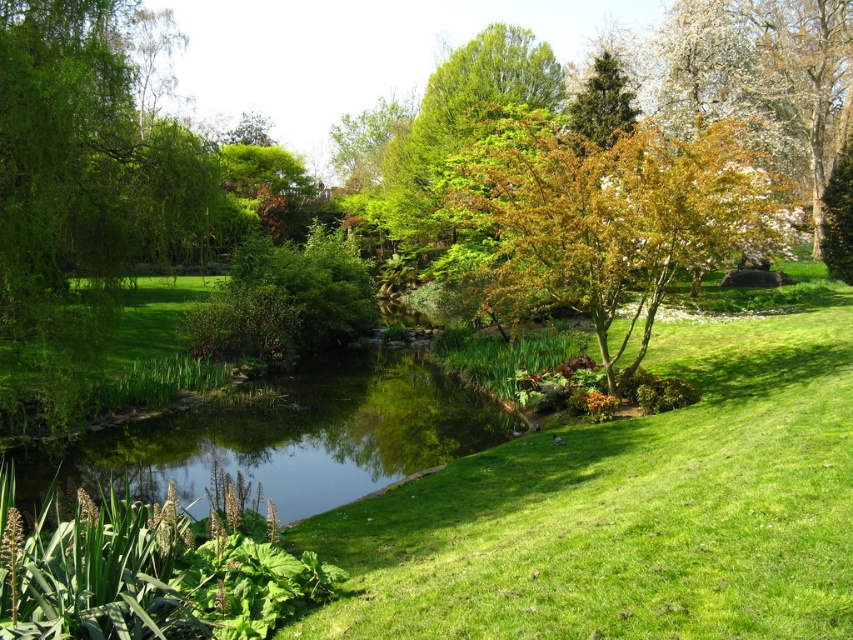
Question: Which point is farther to the camera?

Choices:
 (A) pos(419,396)
 (B) pos(691,371)
 (C) pos(537,100)
 (D) pos(482,193)

Answer: (C)

Question: Is green grassy park at center closer to camera compared to green smooth water at center?

Choices:
 (A) yes
 (B) no

Answer: (A)

Question: Among these points, which one is farthest from the camera?

Choices:
 (A) (679, 621)
 (B) (399, 221)
 (C) (612, 356)
 (D) (316, 481)

Answer: (B)

Question: Can you confirm if green grassy park at center is thinner than green leafy tree at upper center?

Choices:
 (A) yes
 (B) no

Answer: (B)

Question: Is green grassy park at center below orange-brown textured tree at center?

Choices:
 (A) yes
 (B) no

Answer: (A)

Question: Among these objects, which one is farthest from the camera?

Choices:
 (A) orange-brown textured tree at center
 (B) green leafy tree at upper center

Answer: (B)